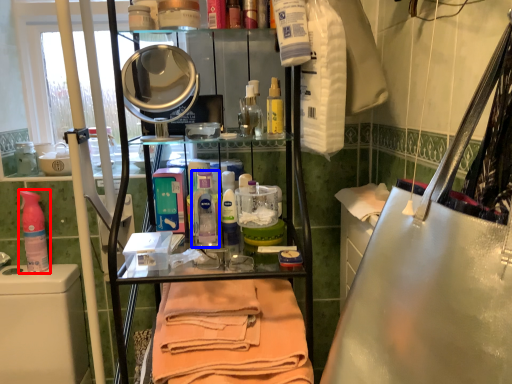
Question: Which point is further to the camera, cleaning product (highlighted by a red box) or cleaning product (highlighted by a blue box)?

Choices:
 (A) cleaning product
 (B) cleaning product

Answer: (A)